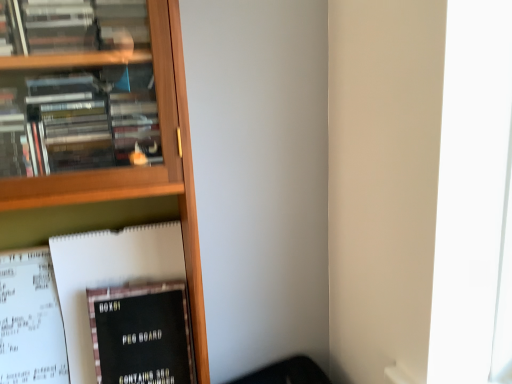
Question: Looking at their shapes, would you say black matte peg board at lower left, which is counted as the 2th book, starting from the bottom, is wider or thinner than black matte peg board at lower left, acting as the 1th book starting from the bottom?

Choices:
 (A) wide
 (B) thin

Answer: (A)

Question: From the image's perspective, is black matte peg board at lower left, positioned as the 1th book in top-to-bottom order, located above or below black matte peg board at lower left, which is counted as the second book, starting from the top?

Choices:
 (A) above
 (B) below

Answer: (A)

Question: Visually, is black matte peg board at lower left, which is counted as the 2th book, starting from the bottom, positioned to the left or to the right of black matte peg board at lower left, acting as the 1th book starting from the bottom?

Choices:
 (A) left
 (B) right

Answer: (A)

Question: From the image's perspective, is black matte peg board at lower left, acting as the 1th book starting from the bottom, above or below black matte peg board at lower left, positioned as the 1th book in top-to-bottom order?

Choices:
 (A) below
 (B) above

Answer: (A)

Question: Based on their positions, is black matte peg board at lower left, acting as the 1th book starting from the bottom, located to the left or right of black matte peg board at lower left, positioned as the 1th book in top-to-bottom order?

Choices:
 (A) right
 (B) left

Answer: (A)

Question: Is black matte peg board at lower left, acting as the 1th book starting from the bottom, wider or thinner than black matte peg board at lower left, positioned as the 1th book in top-to-bottom order?

Choices:
 (A) thin
 (B) wide

Answer: (A)

Question: Is point (179, 362) closer or farther from the camera than point (150, 307)?

Choices:
 (A) farther
 (B) closer

Answer: (A)